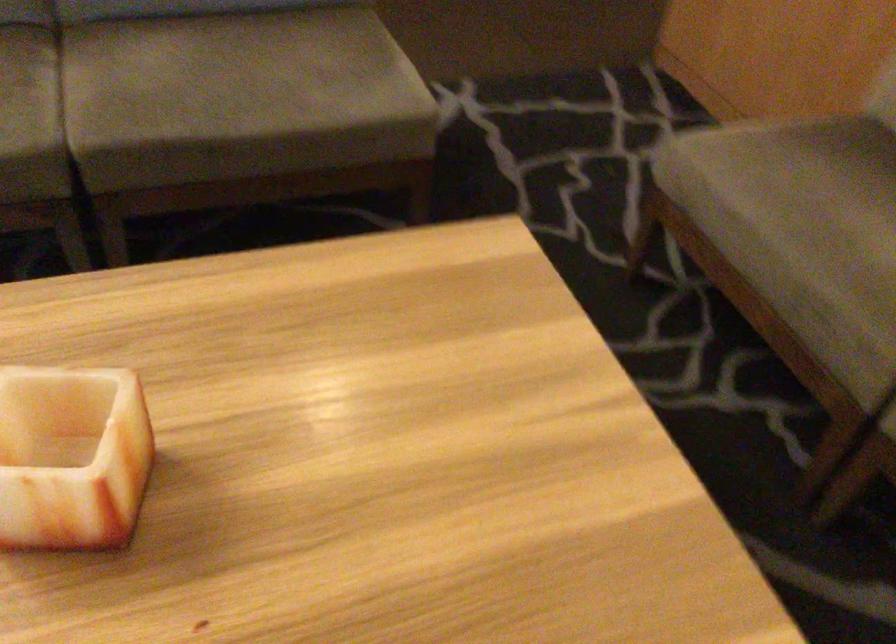
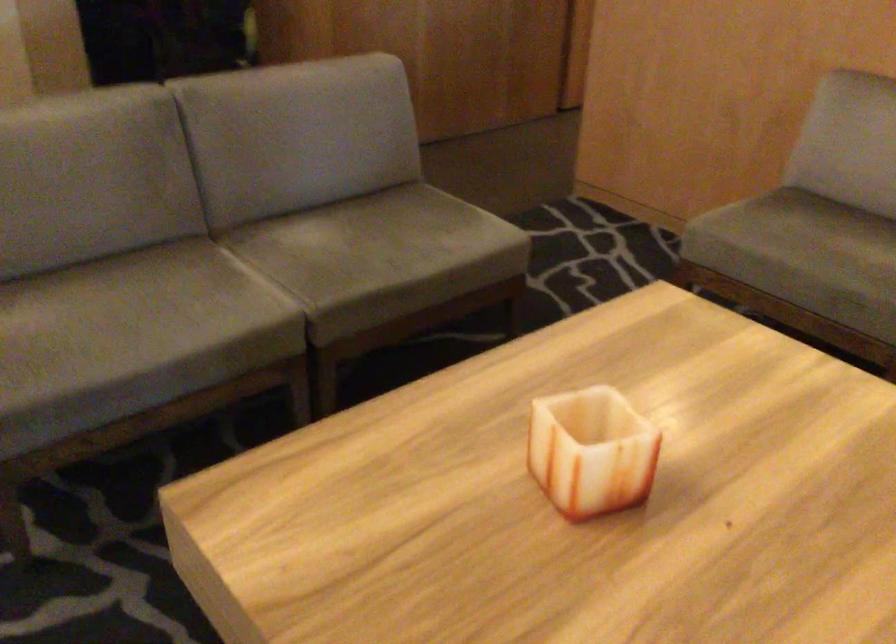
Where in the second image is the point corresponding to the point at 240,88 from the first image?

(385, 247)